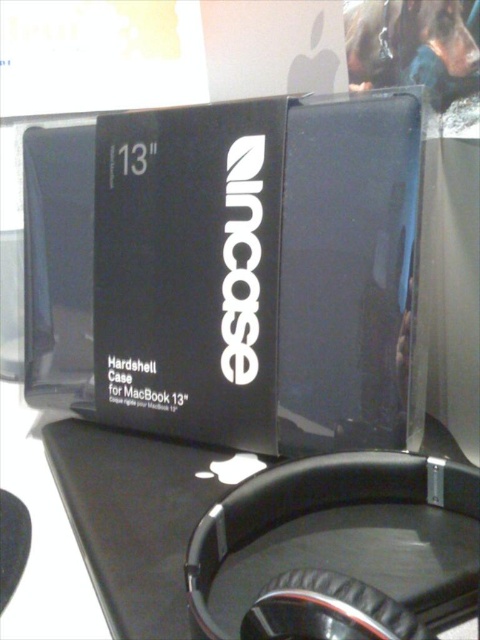
Who is more forward, (376, 448) or (20, 634)?

Point (20, 634) is in front.

Can you confirm if black hardshell case at center is positioned to the right of black matte table at center?

Yes, black hardshell case at center is to the right of black matte table at center.

Is point (121, 188) positioned before point (2, 484)?

No.

I want to click on black hardshell case at center, so click(x=250, y=276).